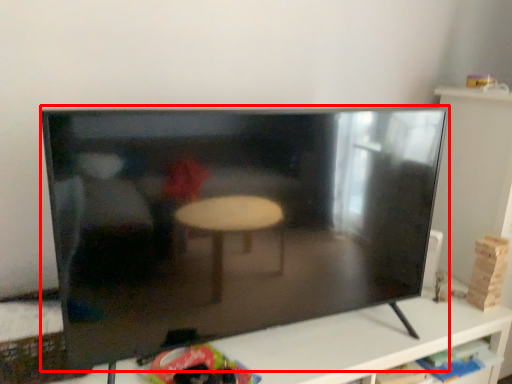
Question: From the image, what is the correct spatial relationship of television (annotated by the red box) in relation to furniture?

Choices:
 (A) right
 (B) left

Answer: (B)